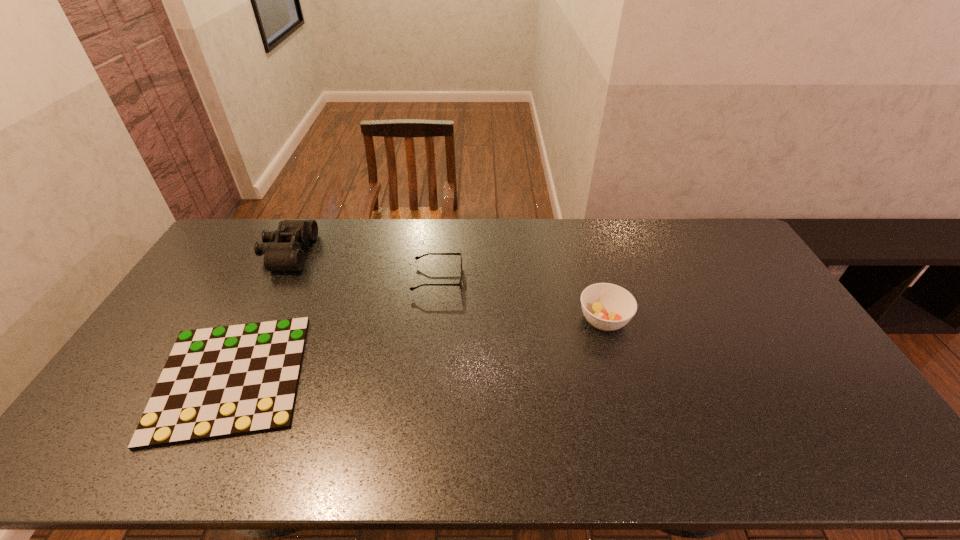
At what (x,y) coordinates should I click in order to perform the action: click on object at the far edge. Please return your answer as a coordinate pair (x, y). Looking at the image, I should click on (282, 249).

The height and width of the screenshot is (540, 960). In order to click on object at the near edge in this screenshot , I will do `click(218, 382)`.

Where is `object present at the left edge`? The image size is (960, 540). object present at the left edge is located at coordinates (218, 382).

Where is `object that is at the near left corner`? object that is at the near left corner is located at coordinates (218, 382).

This screenshot has width=960, height=540. I want to click on free spot at the far edge of the desktop, so click(x=646, y=242).

Where is `free space at the near edge of the desktop`? This screenshot has width=960, height=540. free space at the near edge of the desktop is located at coordinates (281, 454).

What are the coordinates of `unoccupied area between the second object from right to left and the binoculars` in the screenshot? It's located at (363, 266).

This screenshot has height=540, width=960. Find the location of `free spot between the checkerboard and the rightmost object`. free spot between the checkerboard and the rightmost object is located at coordinates (418, 348).

The width and height of the screenshot is (960, 540). Find the location of `vacant area between the rightmost object and the sunglasses`. vacant area between the rightmost object and the sunglasses is located at coordinates (520, 300).

Identify the location of vacant space that's between the tallest object and the shortest object. The height and width of the screenshot is (540, 960). (259, 315).